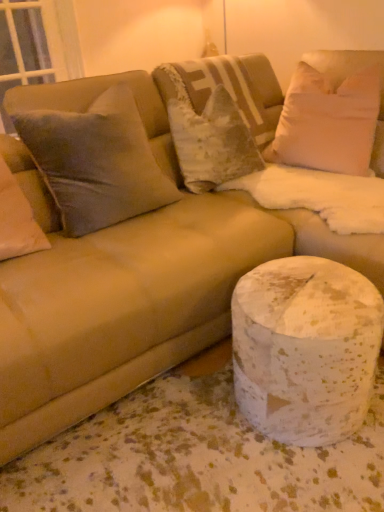
Question: Is white soft pillow at upper right, the 5th pillow in the left-to-right sequence, wider than white speckled marble at lower right?

Choices:
 (A) no
 (B) yes

Answer: (A)

Question: Is there a large distance between white soft pillow at upper right, the 5th pillow in the left-to-right sequence, and white speckled marble at lower right?

Choices:
 (A) yes
 (B) no

Answer: (B)

Question: Is white speckled marble at lower right completely or partially inside white soft pillow at upper right, the 1th pillow positioned from the right?

Choices:
 (A) yes
 (B) no

Answer: (B)

Question: Considering the relative sizes of white soft pillow at upper right, the 1th pillow positioned from the right, and white speckled marble at lower right in the image provided, is white soft pillow at upper right, the 1th pillow positioned from the right, taller than white speckled marble at lower right?

Choices:
 (A) no
 (B) yes

Answer: (B)

Question: Is white soft pillow at upper right, the 1th pillow positioned from the right, smaller than white speckled marble at lower right?

Choices:
 (A) yes
 (B) no

Answer: (B)

Question: Do you think transparent glass window screen at upper left is within white speckled marble at lower right, or outside of it?

Choices:
 (A) outside
 (B) inside

Answer: (A)

Question: From a real-world perspective, is transparent glass window screen at upper left positioned above or below white speckled marble at lower right?

Choices:
 (A) below
 (B) above

Answer: (B)

Question: Is transparent glass window screen at upper left taller or shorter than white speckled marble at lower right?

Choices:
 (A) tall
 (B) short

Answer: (A)

Question: Is point click(x=41, y=31) positioned closer to the camera than point click(x=273, y=386)?

Choices:
 (A) farther
 (B) closer

Answer: (A)

Question: From a real-world perspective, relative to velvet gray pillow at upper left, acting as the 2th pillow starting from the left, is white speckled marble at lower right vertically above or below?

Choices:
 (A) above
 (B) below

Answer: (B)

Question: Is white speckled marble at lower right wider or thinner than velvet gray pillow at upper left, which ranks as the 4th pillow in right-to-left order?

Choices:
 (A) wide
 (B) thin

Answer: (B)

Question: In the image, is white speckled marble at lower right on the left side or the right side of velvet gray pillow at upper left, which ranks as the 4th pillow in right-to-left order?

Choices:
 (A) right
 (B) left

Answer: (A)

Question: In the image, is white speckled marble at lower right positioned in front of or behind velvet gray pillow at upper left, which ranks as the 4th pillow in right-to-left order?

Choices:
 (A) behind
 (B) front

Answer: (B)

Question: From their relative heights in the image, would you say white speckled marble at lower right is taller or shorter than white soft pillow at upper right, the 1th pillow positioned from the right?

Choices:
 (A) tall
 (B) short

Answer: (B)

Question: Relative to white soft pillow at upper right, the 1th pillow positioned from the right, is white speckled marble at lower right in front or behind?

Choices:
 (A) behind
 (B) front

Answer: (B)